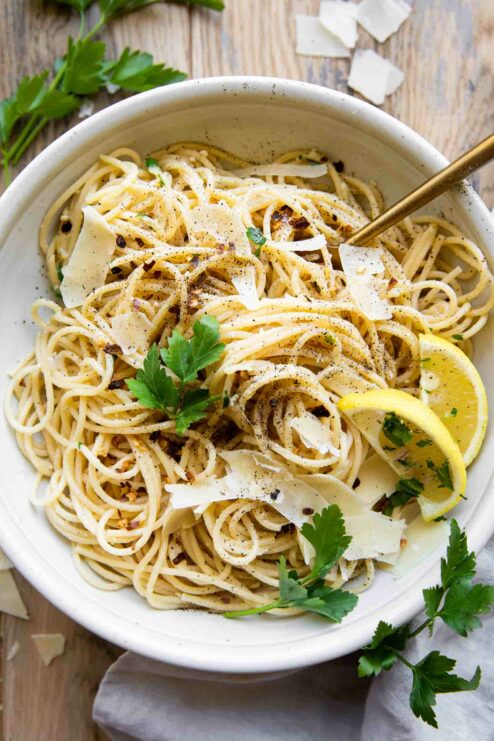
I want to click on table, so click(x=56, y=708).